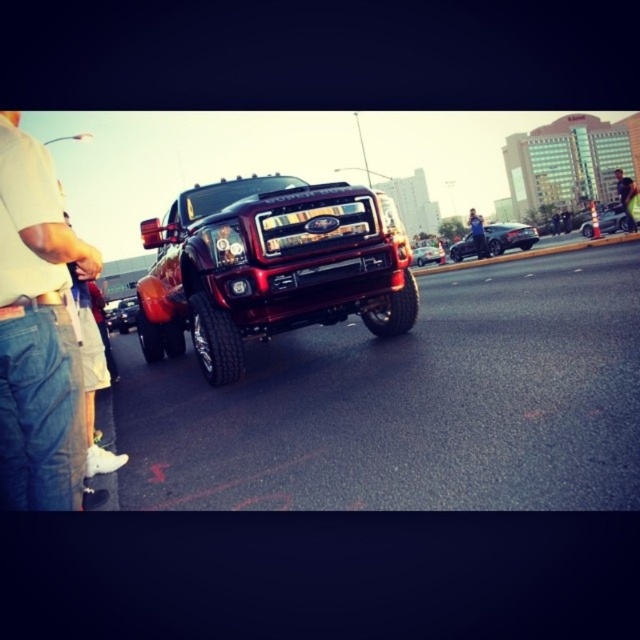
You are a photographer trying to capture both the denim jacket at center and the glossy chrome car at center in a single frame. Considering their sizes, which one will appear bigger in the photo?

The denim jacket at center will appear bigger in the photo because it is larger in size than the glossy chrome car at center.

You are a delivery driver who needs to park your shiny black car at center in a specific spot marked at coordinates 0.370, 0.797. Can you confirm if the current position of your car matches the required parking spot?

The shiny black car at center is already positioned at the coordinates (x=509, y=236), so it is correctly parked in the required spot.

You are standing in the middle of the street and see two points marked in the image. The first point is at coordinates point [362,260] and the second point is at point [6,468]. Which point is closer to you?

Point [362,260] is closer to you because it is further to the camera than point [6,468].